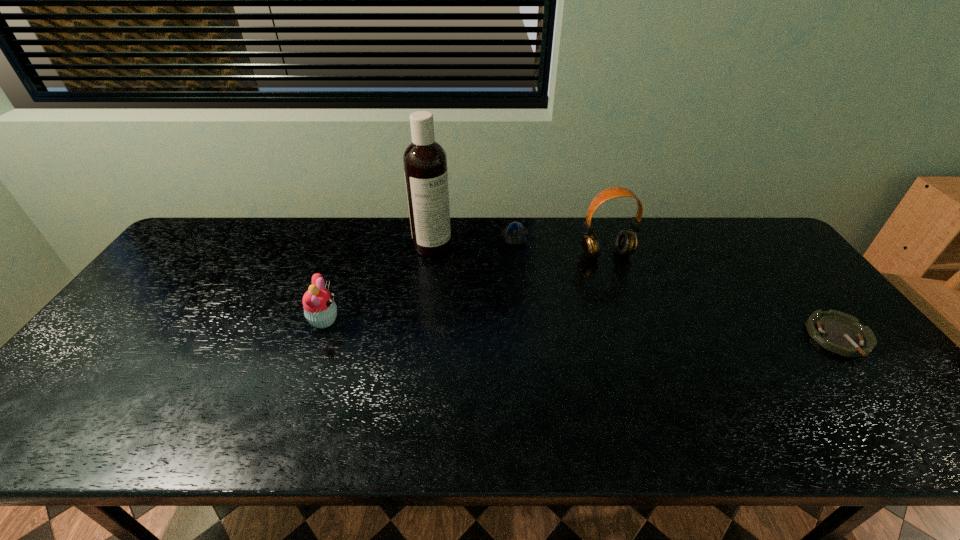
Where is `cupcake`? cupcake is located at coordinates (320, 310).

Locate an element on the screen. the third tallest object is located at coordinates (320, 310).

Where is `ashtray`? ashtray is located at coordinates (841, 333).

I want to click on the rightmost object, so click(841, 333).

Where is `headset`? This screenshot has height=540, width=960. headset is located at coordinates (626, 242).

What are the coordinates of `the second object from right to left` in the screenshot? It's located at (626, 242).

Locate an element on the screen. the third object from right to left is located at coordinates (515, 234).

Locate an element on the screen. The image size is (960, 540). the fourth tallest object is located at coordinates (515, 234).

You are a GUI agent. You are given a task and a screenshot of the screen. Output one action in this format:
    pyautogui.click(x=<x>, y=<y>)
    Task: Click on the second object from left to right
    The height and width of the screenshot is (540, 960).
    Given the screenshot: What is the action you would take?
    425,162

Where is `dishwasher detergent`? The height and width of the screenshot is (540, 960). dishwasher detergent is located at coordinates (425, 162).